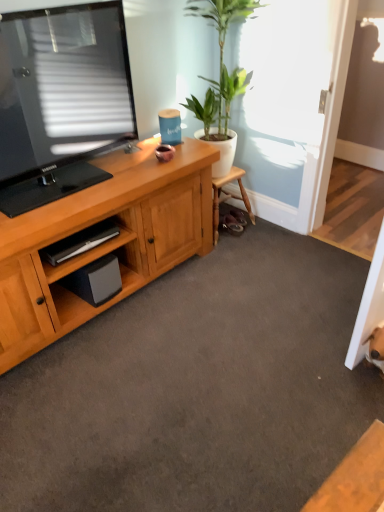
Question: Is the position of wooden cabinet at lower left less distant than that of green glossy plant at upper center?

Choices:
 (A) yes
 (B) no

Answer: (A)

Question: Is wooden cabinet at lower left at the right side of green glossy plant at upper center?

Choices:
 (A) yes
 (B) no

Answer: (B)

Question: Is wooden cabinet at lower left outside of green glossy plant at upper center?

Choices:
 (A) yes
 (B) no

Answer: (A)

Question: Is wooden cabinet at lower left smaller than green glossy plant at upper center?

Choices:
 (A) no
 (B) yes

Answer: (B)

Question: Is wooden cabinet at lower left to the left of green glossy plant at upper center from the viewer's perspective?

Choices:
 (A) yes
 (B) no

Answer: (A)

Question: Does wooden cabinet at lower left touch green glossy plant at upper center?

Choices:
 (A) no
 (B) yes

Answer: (A)

Question: Does black matte speaker at lower left have a larger size compared to green glossy plant at upper center?

Choices:
 (A) no
 (B) yes

Answer: (A)

Question: From a real-world perspective, is black matte speaker at lower left beneath green glossy plant at upper center?

Choices:
 (A) no
 (B) yes

Answer: (B)

Question: Is black matte speaker at lower left beside green glossy plant at upper center?

Choices:
 (A) yes
 (B) no

Answer: (B)

Question: Can you confirm if black matte speaker at lower left is shorter than green glossy plant at upper center?

Choices:
 (A) no
 (B) yes

Answer: (B)

Question: Does black matte speaker at lower left come behind green glossy plant at upper center?

Choices:
 (A) no
 (B) yes

Answer: (B)

Question: Does black matte speaker at lower left appear on the left side of green glossy plant at upper center?

Choices:
 (A) yes
 (B) no

Answer: (A)

Question: Is black matte speaker at lower left closer to camera compared to wooden cabinet at lower left?

Choices:
 (A) yes
 (B) no

Answer: (B)